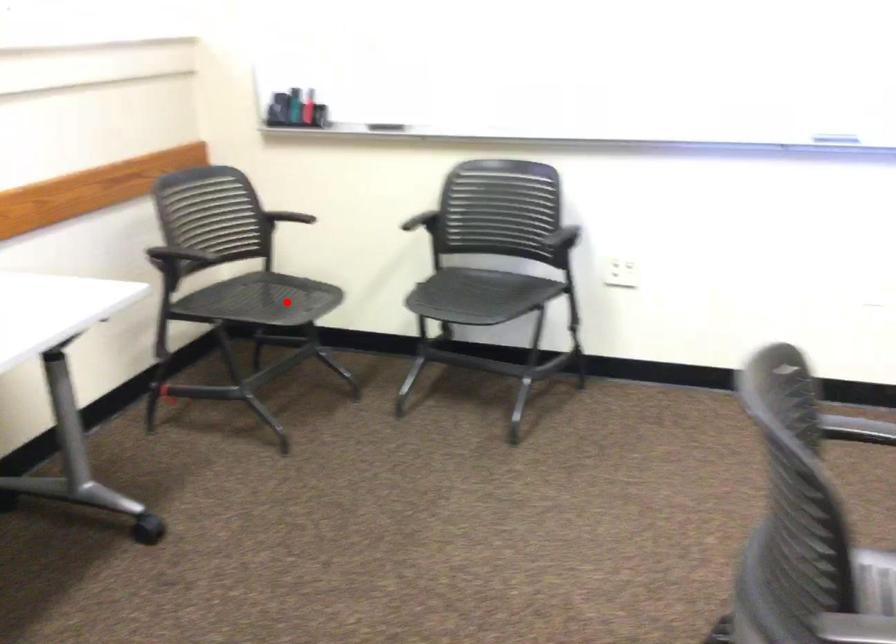
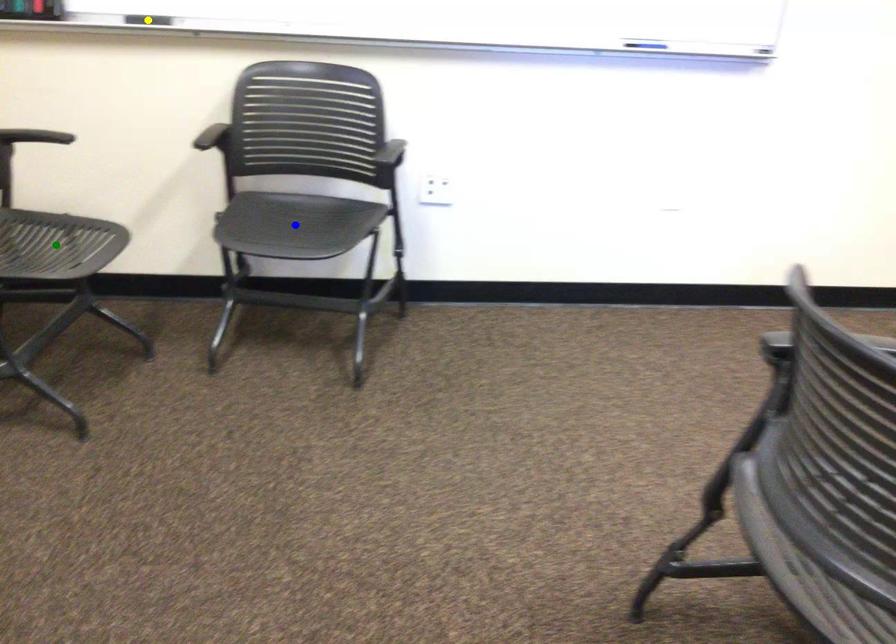
Question: I am providing you with two images of the same scene from different viewpoints. A red point is marked on the first image. You are given multiple points on the second image. Which mark in image 2 goes with the point in image 1?

Choices:
 (A) blue point
 (B) yellow point
 (C) green point

Answer: (C)